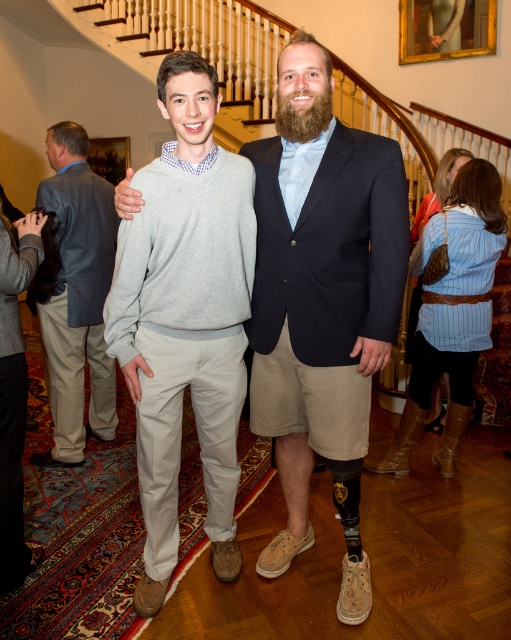
You are a fashion designer observing two gray sweaters in the image. The first is labeled as gray cotton sweater at center, and the second is gray sweater at center. Which of the two gray sweaters is thinner?

The gray cotton sweater at center is thinner than the gray sweater at center.

You are standing at point (97, 296) and want to walk to the exit located at point (273, 396). Is the exit in front of you or behind you?

The exit at point (273, 396) is in front of you because it is in front of point (97, 296) where you are standing.

You are a photographer at a formal event. You need to capture a portrait of the two people wearing the matte black suit at center and the gray sweater at center. Which of their outfits will appear narrower in the photo?

The matte black suit at center is thinner than the gray sweater at center, so the matte black suit at center will appear narrower in the photo.